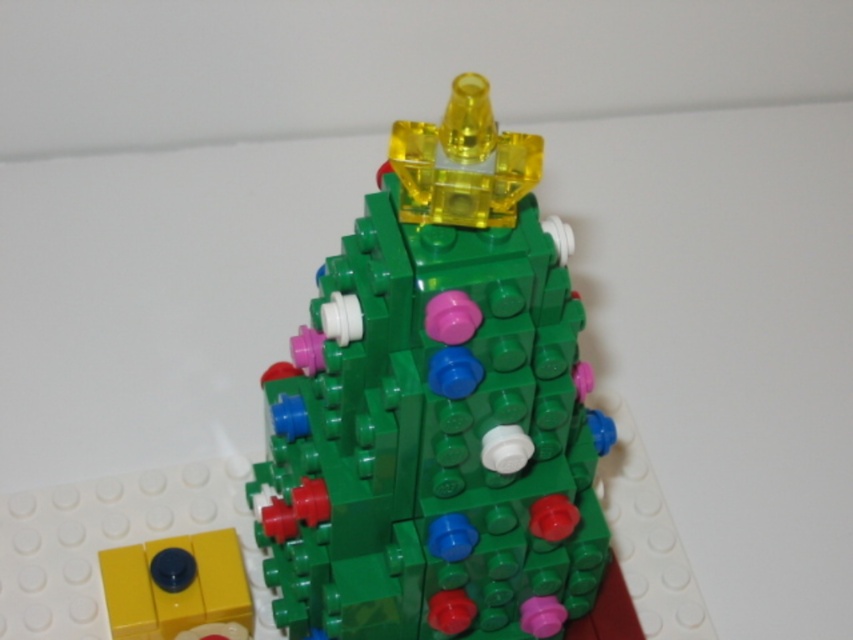
Question: Is translucent yellow plastic at top wider than matte yellow brick at bottom left?

Choices:
 (A) yes
 (B) no

Answer: (A)

Question: Is translucent yellow plastic at top further to the viewer compared to matte yellow brick at bottom left?

Choices:
 (A) no
 (B) yes

Answer: (A)

Question: Which object is closer to the camera taking this photo?

Choices:
 (A) translucent yellow plastic at top
 (B) matte yellow brick at bottom left

Answer: (A)

Question: Can you confirm if translucent yellow plastic at top is positioned below matte yellow brick at bottom left?

Choices:
 (A) yes
 (B) no

Answer: (B)

Question: Which of the following is the closest to the observer?

Choices:
 (A) matte yellow brick at bottom left
 (B) translucent yellow plastic at top

Answer: (B)

Question: Which point is closer to the camera taking this photo?

Choices:
 (A) (248, 611)
 (B) (518, 522)

Answer: (B)